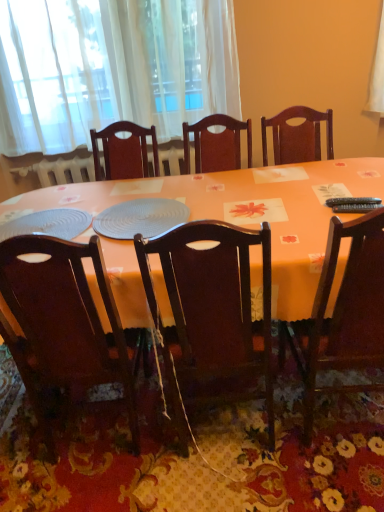
Where is `vacant space behind black plastic remote control at right, the 2th remote control ordered from the bottom`? The width and height of the screenshot is (384, 512). vacant space behind black plastic remote control at right, the 2th remote control ordered from the bottom is located at coordinates (339, 191).